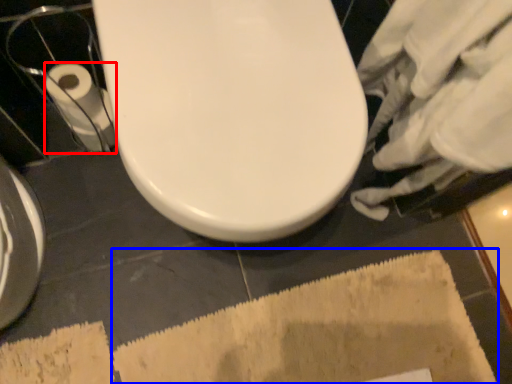
Question: Which of the following is the farthest to the observer, toilet paper (highlighted by a red box) or bath mat (highlighted by a blue box)?

Choices:
 (A) toilet paper
 (B) bath mat

Answer: (A)